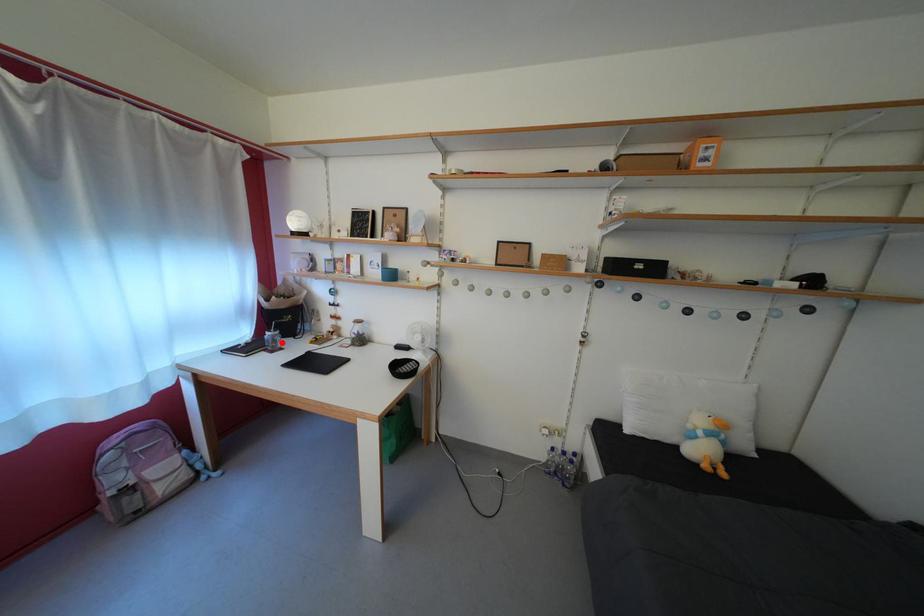
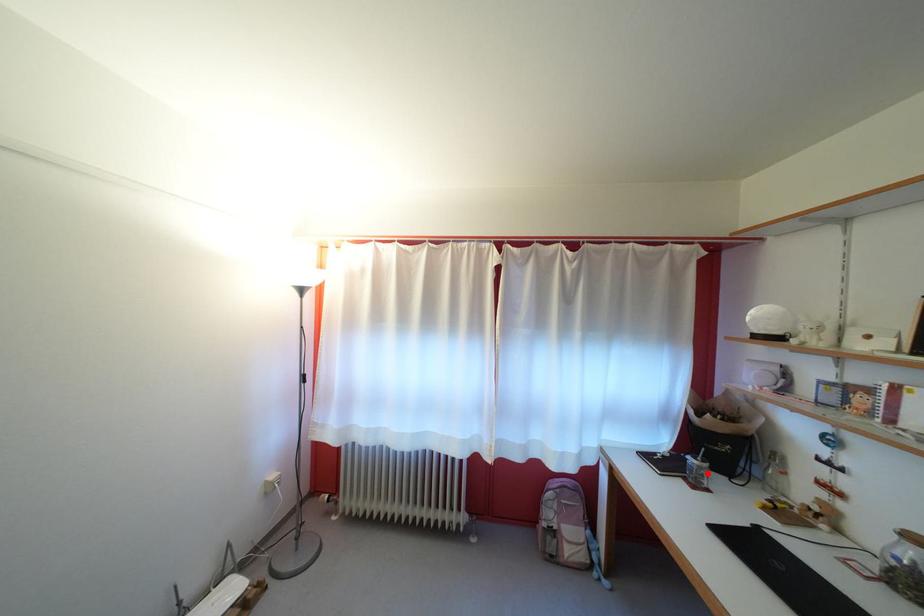
I am providing you with two images of the same scene from different viewpoints. A red point is marked on the first image and another point is marked on the second image. Is the red point in image1 aligned with the point shown in image2?

Yes